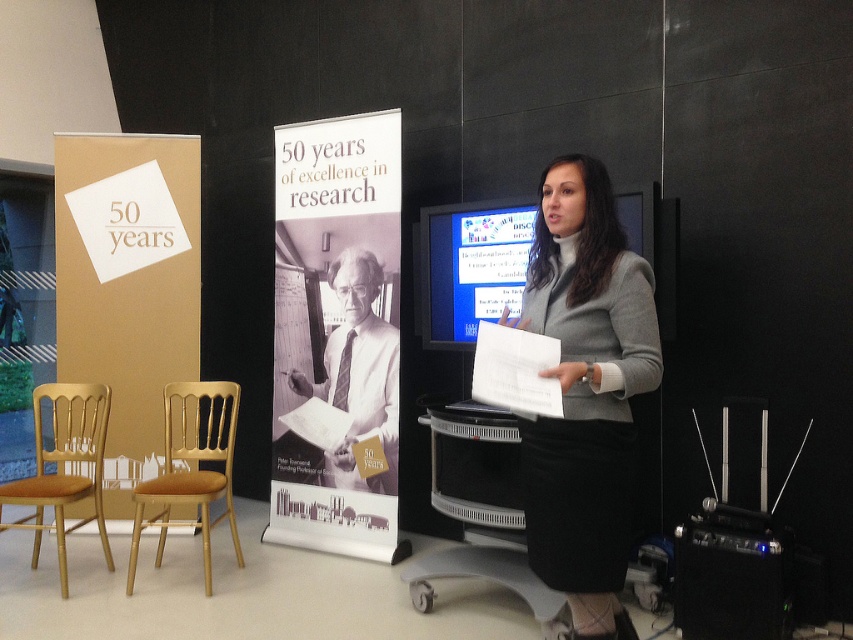
Question: Among these objects, which one is farthest from the camera?

Choices:
 (A) gold wood chair at left
 (B) gray woolen sweater at center
 (C) black and white banner at center

Answer: (C)

Question: Which object appears farthest from the camera in this image?

Choices:
 (A) gold wood chair at left
 (B) gold wood chair at lower left
 (C) black plastic speaker at lower right
 (D) gray woolen sweater at center

Answer: (B)

Question: Does black plastic speaker at lower right have a larger size compared to gold wood chair at lower left?

Choices:
 (A) yes
 (B) no

Answer: (B)

Question: Does matte gold poster at left appear on the right side of gold wood chair at left?

Choices:
 (A) yes
 (B) no

Answer: (A)

Question: Is matte gold poster at left below gold wood chair at lower left?

Choices:
 (A) no
 (B) yes

Answer: (A)

Question: Which is farther from the matte gold poster at left?

Choices:
 (A) gold wood chair at left
 (B) gray woolen sweater at center
 (C) black plastic speaker at lower right

Answer: (C)